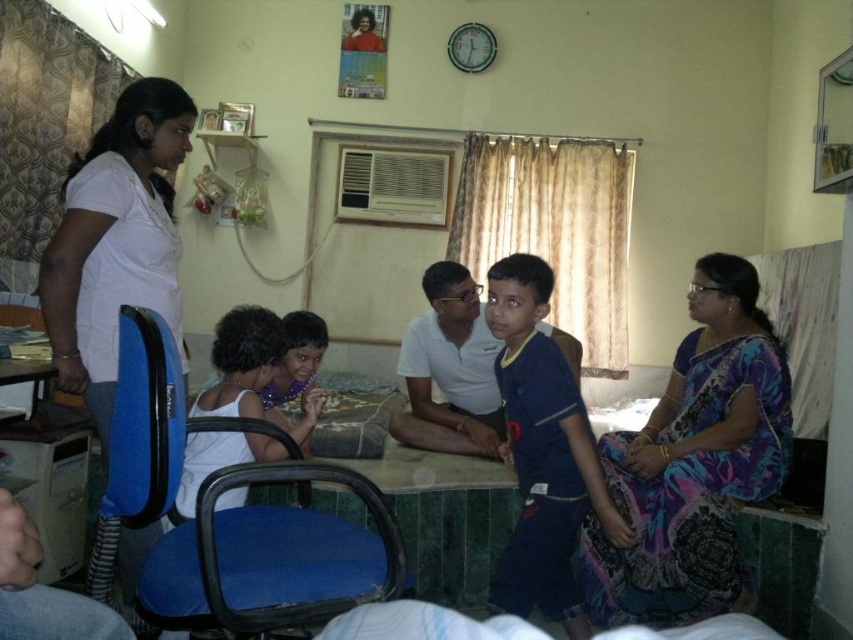
You are trying to decide where to place a new large decorative item in the room. The item is bigger than the white matte shirt at left but smaller than the green marble table at center. Which object can you use as a reference to ensure the item will fit in the space?

Since the white matte shirt at left is smaller than the green marble table at center, you can use the green marble table at center as a reference. If the new item is smaller than the green marble table at center, it should fit in the space.